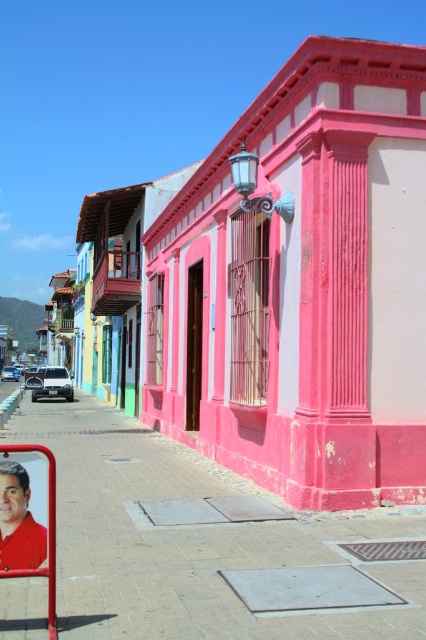
Question: Based on their relative distances, which object is farther from the white matte car at center?

Choices:
 (A) white matte car at left
 (B) smooth red shirt at lower left

Answer: (B)

Question: Is smooth red shirt at lower left wider than white matte car at left?

Choices:
 (A) yes
 (B) no

Answer: (B)

Question: Is smooth red shirt at lower left wider than white matte car at left?

Choices:
 (A) no
 (B) yes

Answer: (A)

Question: Which point is farther to the camera?

Choices:
 (A) (46, 388)
 (B) (5, 378)
 (C) (37, 532)
 (D) (256, 360)

Answer: (B)

Question: Is smooth red shirt at lower left behind white matte car at center?

Choices:
 (A) yes
 (B) no

Answer: (B)

Question: Which object is closer to the camera taking this photo?

Choices:
 (A) white matte car at center
 (B) pink painted building at center
 (C) white matte car at left

Answer: (B)